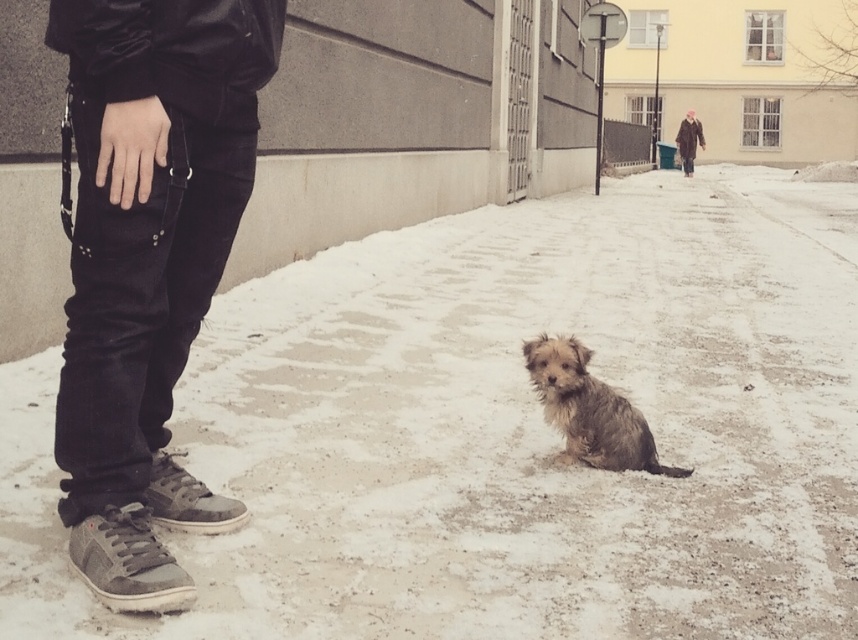
Question: Among these objects, which one is nearest to the camera?

Choices:
 (A) black leather pants at lower left
 (B) white powdery snow at lower center
 (C) fuzzy brown dog at center
 (D) brown leather coat at upper right

Answer: (A)

Question: Considering the relative positions of black leather pants at lower left and fuzzy brown dog at center in the image provided, where is black leather pants at lower left located with respect to fuzzy brown dog at center?

Choices:
 (A) below
 (B) above

Answer: (B)

Question: Is black leather pants at lower left thinner than brown leather coat at upper right?

Choices:
 (A) yes
 (B) no

Answer: (A)

Question: Estimate the real-world distances between objects in this image. Which object is farther from the white powdery snow at lower center?

Choices:
 (A) fuzzy brown dog at center
 (B) black leather pants at lower left
 (C) brown leather coat at upper right

Answer: (C)

Question: Observing the image, what is the correct spatial positioning of fuzzy brown dog at center in reference to brown leather coat at upper right?

Choices:
 (A) below
 (B) above

Answer: (A)

Question: Which object is farther from the camera taking this photo?

Choices:
 (A) fuzzy brown dog at center
 (B) brown leather coat at upper right
 (C) black leather pants at lower left

Answer: (B)